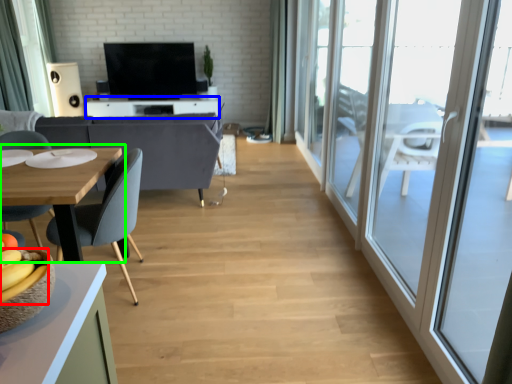
Question: Which object is the closest to the banana (highlighted by a red box)? Choose among these: table (highlighted by a blue box) or table (highlighted by a green box).

Choices:
 (A) table
 (B) table

Answer: (B)